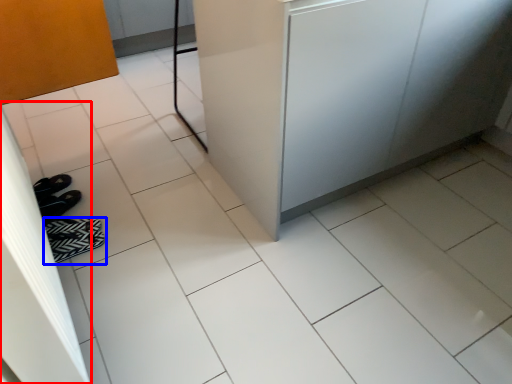
Question: Which of the following is the closest to the observer, screen door (highlighted by a red box) or footwear (highlighted by a blue box)?

Choices:
 (A) screen door
 (B) footwear

Answer: (A)